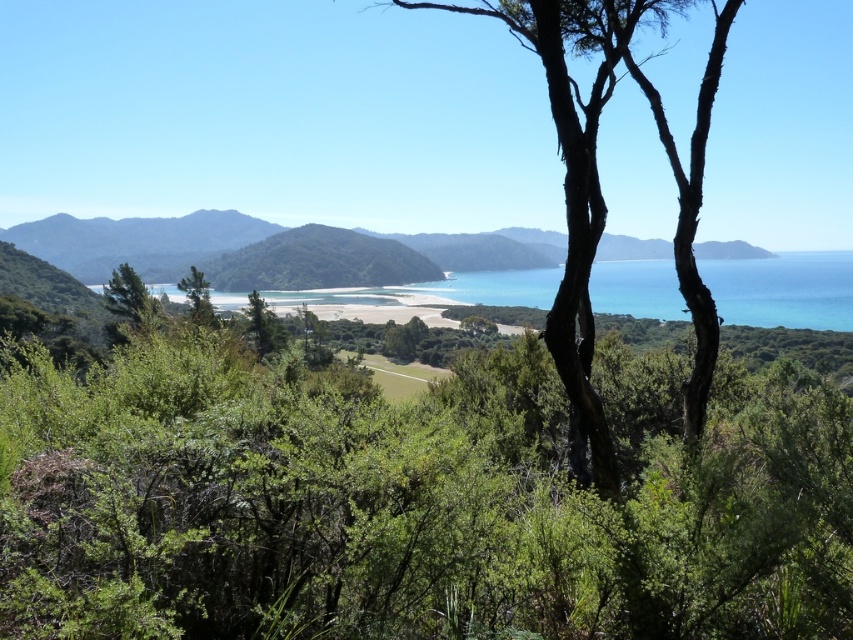
Question: Which point appears closest to the camera in this image?

Choices:
 (A) (583, 12)
 (B) (193, 308)
 (C) (76, 253)

Answer: (A)

Question: Is green grassy mountain at center thinner than green matte tree at center?

Choices:
 (A) no
 (B) yes

Answer: (A)

Question: Among these objects, which one is nearest to the camera?

Choices:
 (A) smooth bark tree at center
 (B) green matte tree at center
 (C) turquoise glossy water at center

Answer: (A)

Question: Which point appears closest to the camera in this image?

Choices:
 (A) (646, 10)
 (B) (631, 282)

Answer: (A)

Question: Does green leafy tree at center appear on the right side of smooth bark tree at center?

Choices:
 (A) yes
 (B) no

Answer: (B)

Question: Is smooth bark tree at center bigger than green grassy mountain at center?

Choices:
 (A) no
 (B) yes

Answer: (A)